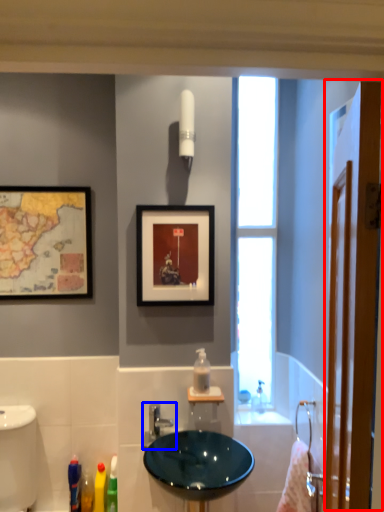
Question: Which of the following is the farthest to the observer, screen door (highlighted by a red box) or tap (highlighted by a blue box)?

Choices:
 (A) screen door
 (B) tap

Answer: (B)